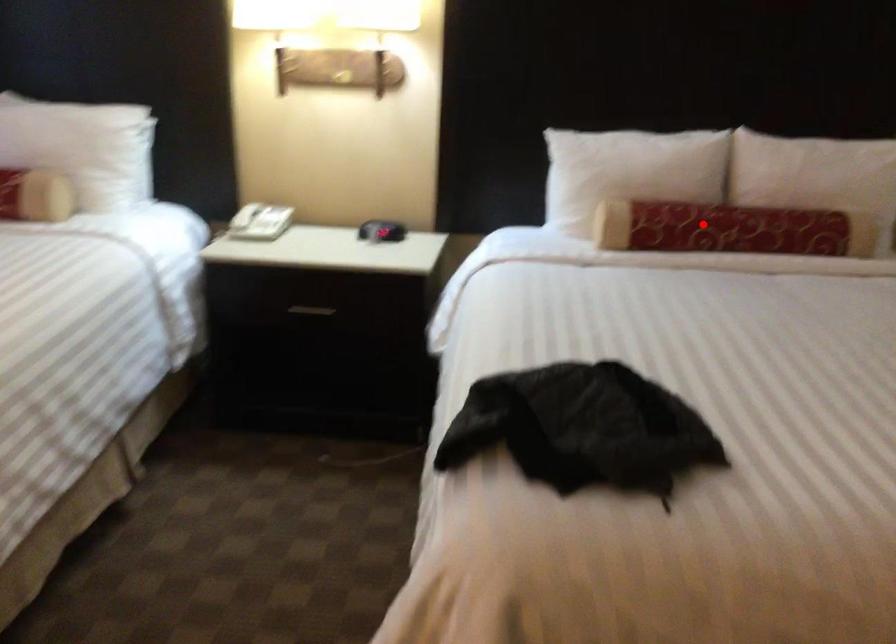
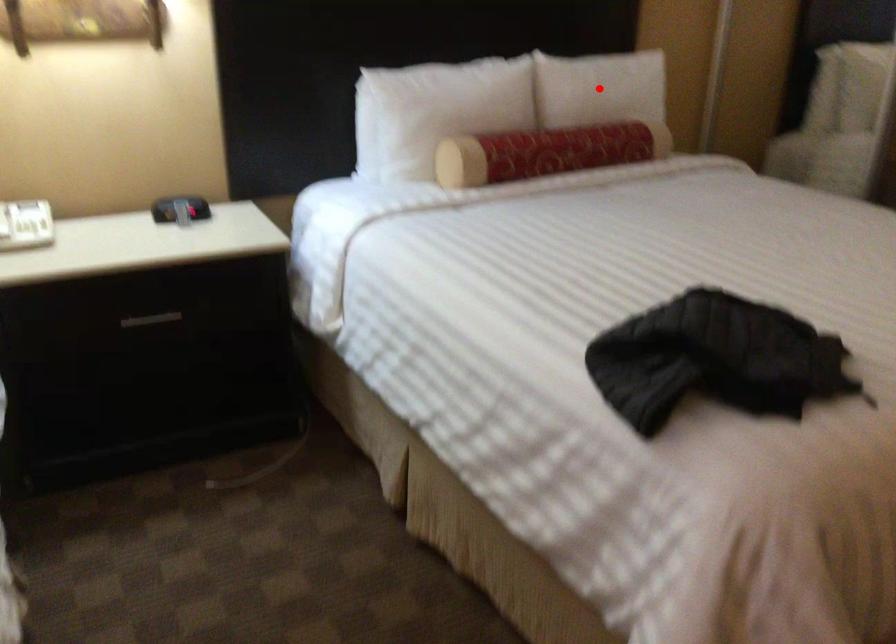
I am providing you with two images of the same scene from different viewpoints. A red point is marked on the first image and another point is marked on the second image. Are the points marked in image1 and image2 representing the same 3D position?

No